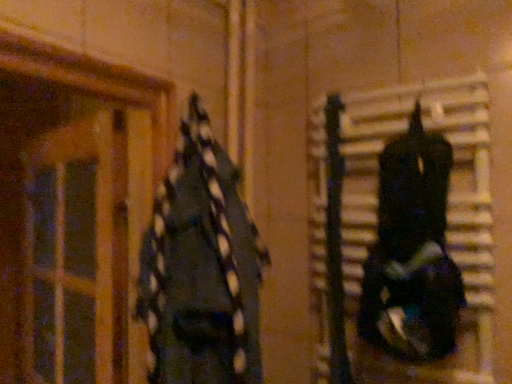
Question: Does translucent wooden door at left have a lesser width compared to dark blue fabric at left, marked as the 1th clothing in a left-to-right arrangement?

Choices:
 (A) no
 (B) yes

Answer: (B)

Question: Is translucent wooden door at left at the right side of dark blue fabric at left, marked as the 1th clothing in a left-to-right arrangement?

Choices:
 (A) yes
 (B) no

Answer: (B)

Question: Is translucent wooden door at left not inside dark blue fabric at left, which is the 2th clothing in right-to-left order?

Choices:
 (A) no
 (B) yes

Answer: (B)

Question: Can you confirm if translucent wooden door at left is wider than dark blue fabric at left, marked as the 1th clothing in a left-to-right arrangement?

Choices:
 (A) no
 (B) yes

Answer: (A)

Question: Could you tell me if translucent wooden door at left is turned towards dark blue fabric at left, marked as the 1th clothing in a left-to-right arrangement?

Choices:
 (A) yes
 (B) no

Answer: (B)

Question: Is translucent wooden door at left to the left of dark blue fabric at left, marked as the 1th clothing in a left-to-right arrangement, from the viewer's perspective?

Choices:
 (A) yes
 (B) no

Answer: (A)

Question: From a real-world perspective, is shiny black helmet at right, the second clothing positioned from the left, over translucent wooden door at left?

Choices:
 (A) yes
 (B) no

Answer: (A)

Question: Is shiny black helmet at right, the second clothing positioned from the left, wider than translucent wooden door at left?

Choices:
 (A) yes
 (B) no

Answer: (A)

Question: Is shiny black helmet at right, the second clothing positioned from the left, to the right of translucent wooden door at left from the viewer's perspective?

Choices:
 (A) yes
 (B) no

Answer: (A)

Question: Does shiny black helmet at right, marked as the 1th clothing in a right-to-left arrangement, appear on the left side of translucent wooden door at left?

Choices:
 (A) no
 (B) yes

Answer: (A)

Question: Considering the relative sizes of shiny black helmet at right, the second clothing positioned from the left, and translucent wooden door at left in the image provided, is shiny black helmet at right, the second clothing positioned from the left, thinner than translucent wooden door at left?

Choices:
 (A) yes
 (B) no

Answer: (B)

Question: Can you confirm if shiny black helmet at right, marked as the 1th clothing in a right-to-left arrangement, is shorter than translucent wooden door at left?

Choices:
 (A) no
 (B) yes

Answer: (B)

Question: Is translucent wooden door at left in front of shiny black helmet at right, the second clothing positioned from the left?

Choices:
 (A) yes
 (B) no

Answer: (B)